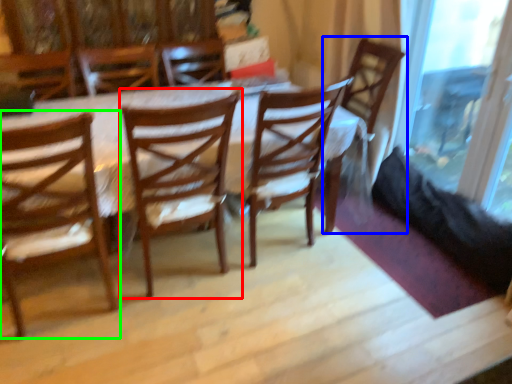
Question: Which object is the farthest from chair (highlighted by a red box)? Choose among these: chair (highlighted by a blue box) or chair (highlighted by a green box).

Choices:
 (A) chair
 (B) chair

Answer: (A)